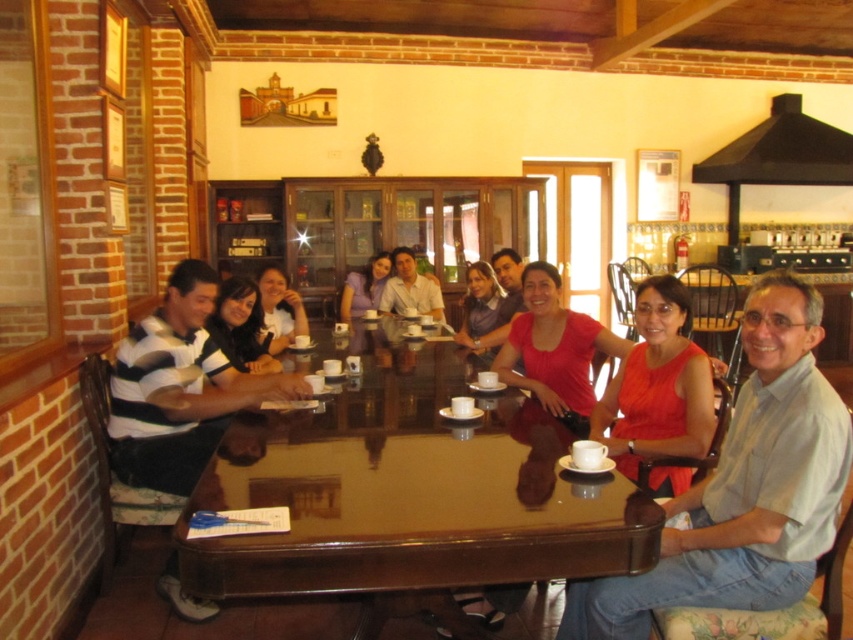
You are sitting at the glossy wood table at center and want to hand a document to the person wearing the matte red dress at center. Which direction should you move to reach them?

The glossy wood table at center is positioned on the left side of the matte red dress at center, so you should move to your right to reach the person wearing the matte red dress at center.

You are sitting at the large wooden table in the cozy cafe. You notice two points marked on the table surface. Which point is closer to you, point (228, 470) or point (631, 419)?

Point (228, 470) is closer to the viewer than point (631, 419).

You are sitting at the glossy wood table at center and want to hand a document to the person wearing the matte red dress at center. Can you directly hand it to them without leaving your seat?

The glossy wood table at center is in front of the matte red dress at center, so you can directly hand the document to them without leaving your seat.